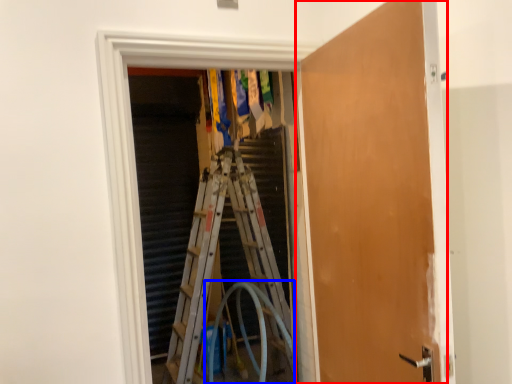
Question: Which object is closer to the camera taking this photo, door (highlighted by a red box) or garden hose (highlighted by a blue box)?

Choices:
 (A) door
 (B) garden hose

Answer: (A)